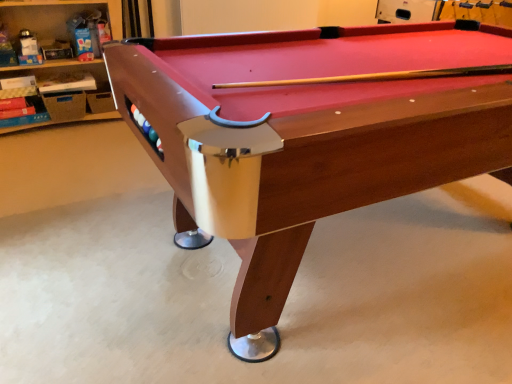
What do you see at coordinates (309, 134) in the screenshot? The height and width of the screenshot is (384, 512). I see `wooden pool table at center` at bounding box center [309, 134].

The width and height of the screenshot is (512, 384). Find the location of `wooden pool table at center`. wooden pool table at center is located at coordinates (309, 134).

Image resolution: width=512 pixels, height=384 pixels. What do you see at coordinates (56, 15) in the screenshot? I see `wooden shelves at left` at bounding box center [56, 15].

In order to click on wooden shelves at left in this screenshot , I will do `click(56, 15)`.

The height and width of the screenshot is (384, 512). I want to click on wooden pool table at center, so click(x=309, y=134).

Which is more to the right, wooden pool table at center or wooden shelves at left?

From the viewer's perspective, wooden pool table at center appears more on the right side.

Looking at this image, in the image, is wooden pool table at center positioned in front of or behind wooden shelves at left?

In the image, wooden pool table at center appears in front of wooden shelves at left.

Which point is more distant from viewer, (475, 35) or (63, 36)?

Point (63, 36)

From the image's perspective, which is below, wooden pool table at center or wooden shelves at left?

wooden pool table at center.

From a real-world perspective, which object stands above the other?

In real-world perspective, wooden pool table at center is above.

Which of these two, wooden pool table at center or wooden shelves at left, is wider?

Wider between the two is wooden pool table at center.

Can you confirm if wooden pool table at center is taller than wooden shelves at left?

Yes.

Between wooden pool table at center and wooden shelves at left, which one has smaller size?

Smaller between the two is wooden shelves at left.

Is wooden shelves at left surrounded by wooden pool table at center?

No, wooden pool table at center does not contain wooden shelves at left.

Is wooden pool table at center next to wooden shelves at left and touching it?

No, wooden pool table at center is not beside wooden shelves at left.

Is wooden pool table at center positioned with its back to wooden shelves at left?

Yes, wooden pool table at center's orientation is away from wooden shelves at left.

Where is `billiard table in front of the wooden shelves at left`? The height and width of the screenshot is (384, 512). billiard table in front of the wooden shelves at left is located at coordinates (309, 134).

Is wooden shelves at left at the left side of wooden pool table at center?

Yes.

Is wooden shelves at left positioned before wooden pool table at center?

No, wooden shelves at left is further to the viewer.

Which is closer to the camera, (44,122) or (308,46)?

Clearly, point (44,122) is more distant from the camera than point (308,46).

From the image's perspective, is wooden shelves at left above or below wooden pool table at center?

wooden shelves at left is above wooden pool table at center.

From a real-world perspective, is wooden shelves at left on top of wooden pool table at center?

No, from a real-world perspective, wooden shelves at left is not over wooden pool table at center

Which object is thinner, wooden shelves at left or wooden pool table at center?

wooden shelves at left.

In terms of height, does wooden shelves at left look taller or shorter compared to wooden pool table at center?

Clearly, wooden shelves at left is shorter compared to wooden pool table at center.

Can you confirm if wooden shelves at left is smaller than wooden pool table at center?

Yes.

Consider the image. Is wooden shelves at left completely or partially outside of wooden pool table at center?

Result: Yes.

From the picture: Is wooden shelves at left directly adjacent to wooden pool table at center?

No, wooden shelves at left is not touching wooden pool table at center.

Consider the image. Could you tell me if wooden shelves at left is turned towards wooden pool table at center?

Yes, wooden shelves at left is turned towards wooden pool table at center.

In order to click on shelf above the wooden pool table at center (from the image's perspective) in this screenshot , I will do `click(56, 15)`.

The image size is (512, 384). In order to click on billiard table that appears below the wooden shelves at left (from the image's perspective) in this screenshot , I will do `click(309, 134)`.

I want to click on shelf behind the wooden pool table at center, so click(56, 15).